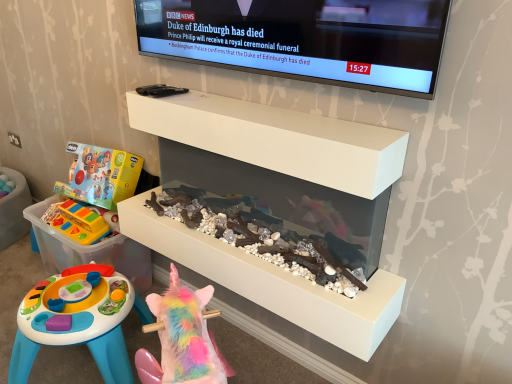
Identify the location of free point below black glossy tv at upper center (from a real-world perspective). (254, 102).